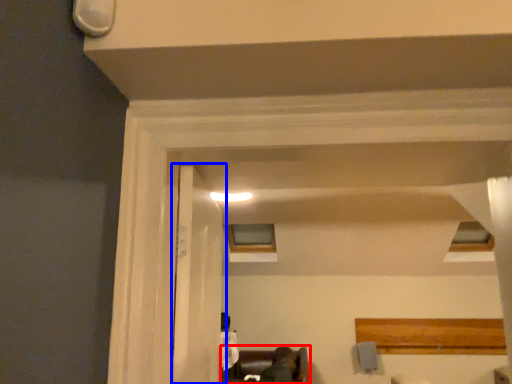
Question: Which object is closer to the camera taking this photo, furniture (highlighted by a red box) or door (highlighted by a blue box)?

Choices:
 (A) furniture
 (B) door

Answer: (B)